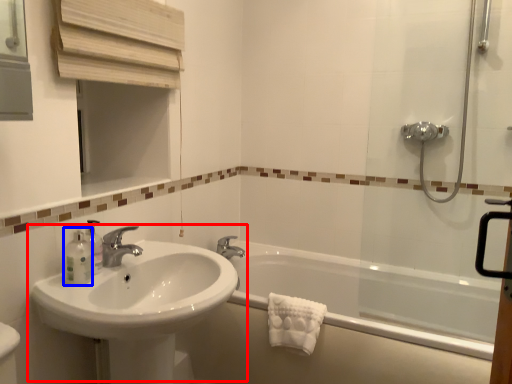
Question: Which point is further to the camera, sink (highlighted by a red box) or toiletry (highlighted by a blue box)?

Choices:
 (A) sink
 (B) toiletry

Answer: (B)